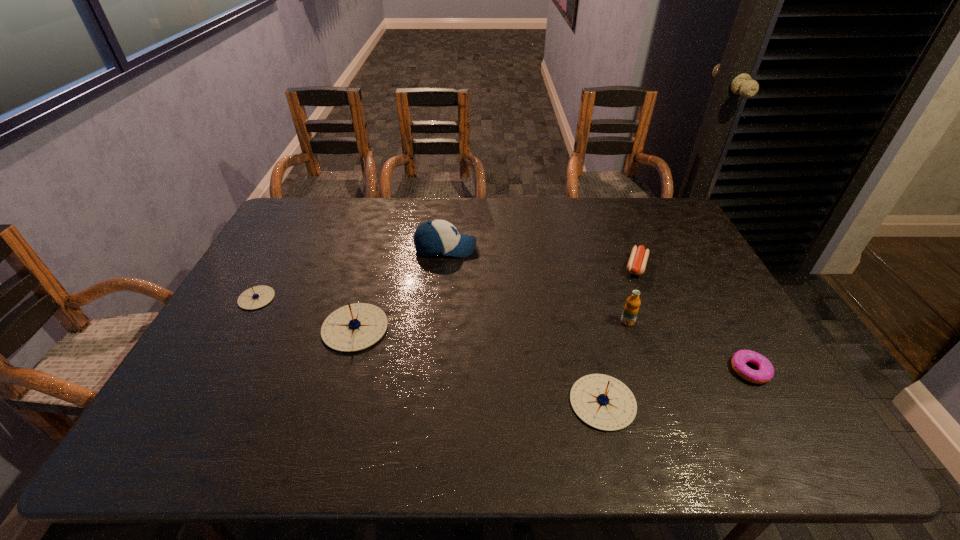
Where is `the shortest compass`? Image resolution: width=960 pixels, height=540 pixels. the shortest compass is located at coordinates (256, 297).

This screenshot has height=540, width=960. I want to click on the third shortest object, so click(x=256, y=297).

I want to click on the sixth object from right to left, so click(354, 327).

Locate an element on the screen. the second shortest compass is located at coordinates pyautogui.click(x=603, y=402).

At what (x,y) coordinates should I click in order to perform the action: click on the fourth shortest object. Please return your answer as a coordinate pair (x, y). The height and width of the screenshot is (540, 960). Looking at the image, I should click on (603, 402).

Identify the location of the second shortest object. The image size is (960, 540). (637, 262).

The image size is (960, 540). In order to click on the second object from right to left in this screenshot , I will do `click(637, 262)`.

The height and width of the screenshot is (540, 960). Identify the location of the third object from left to right. click(435, 237).

Locate an element on the screen. The height and width of the screenshot is (540, 960). the rightmost object is located at coordinates pos(765,373).

The image size is (960, 540). Find the location of `doughnut`. doughnut is located at coordinates (765, 373).